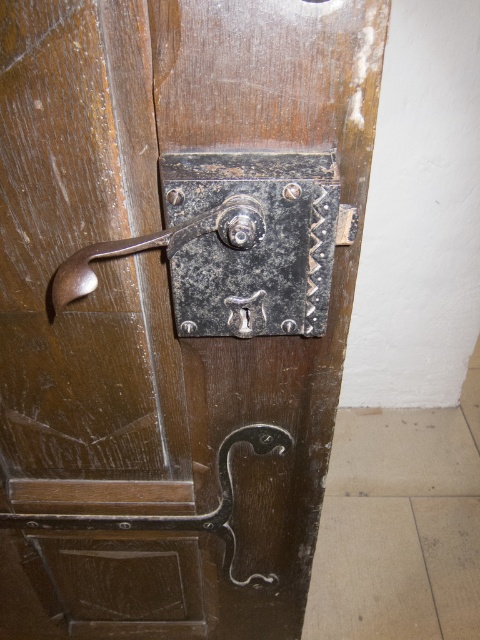
Question: Which point is closer to the camera taking this photo?

Choices:
 (A) (226, 563)
 (B) (95, 257)

Answer: (B)

Question: Can you confirm if polished dark brown metal hook at lower center is thinner than polished brass lever at center?

Choices:
 (A) no
 (B) yes

Answer: (A)

Question: From the image, what is the correct spatial relationship of polished dark brown metal hook at lower center in relation to polished brass lever at center?

Choices:
 (A) above
 (B) below

Answer: (B)

Question: Is polished dark brown metal hook at lower center wider than polished brass lever at center?

Choices:
 (A) no
 (B) yes

Answer: (B)